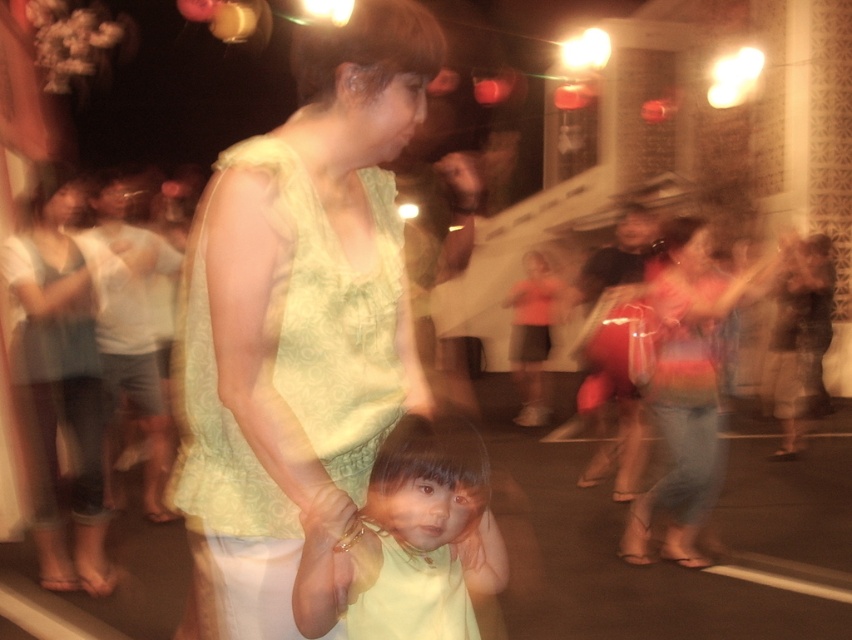
Question: Does light green fabric at center appear over light yellow fabric at center?

Choices:
 (A) no
 (B) yes

Answer: (A)

Question: Which point is farther to the camera?

Choices:
 (A) (413, 586)
 (B) (395, 104)

Answer: (A)

Question: Can you confirm if light green fabric at center is positioned to the right of light yellow fabric at center?

Choices:
 (A) no
 (B) yes

Answer: (A)

Question: Is light green fabric at center wider than light yellow fabric at center?

Choices:
 (A) no
 (B) yes

Answer: (B)

Question: Which point is closer to the camera?

Choices:
 (A) light yellow fabric at center
 (B) light green fabric at center

Answer: (A)